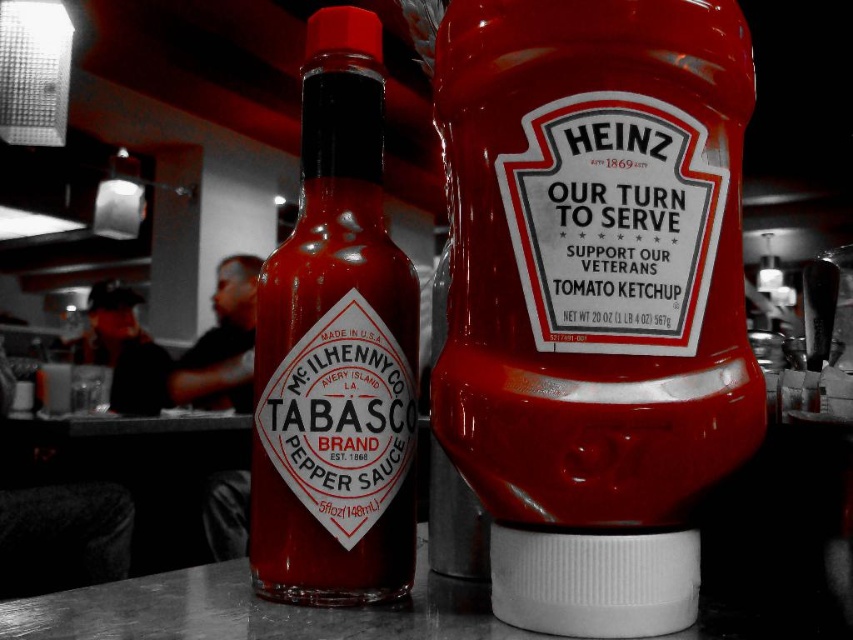
Question: Is glossy plastic bottle at center behind matte glass tabasco pepper sauce at center?

Choices:
 (A) no
 (B) yes

Answer: (A)

Question: Observing the image, what is the correct spatial positioning of glossy plastic bottle at center in reference to matte glass tabasco pepper sauce at center?

Choices:
 (A) below
 (B) above

Answer: (B)

Question: Is glossy plastic bottle at center below matte glass tabasco pepper sauce at center?

Choices:
 (A) yes
 (B) no

Answer: (B)

Question: Which of the following is the closest to the observer?

Choices:
 (A) (306, 225)
 (B) (537, 346)

Answer: (B)